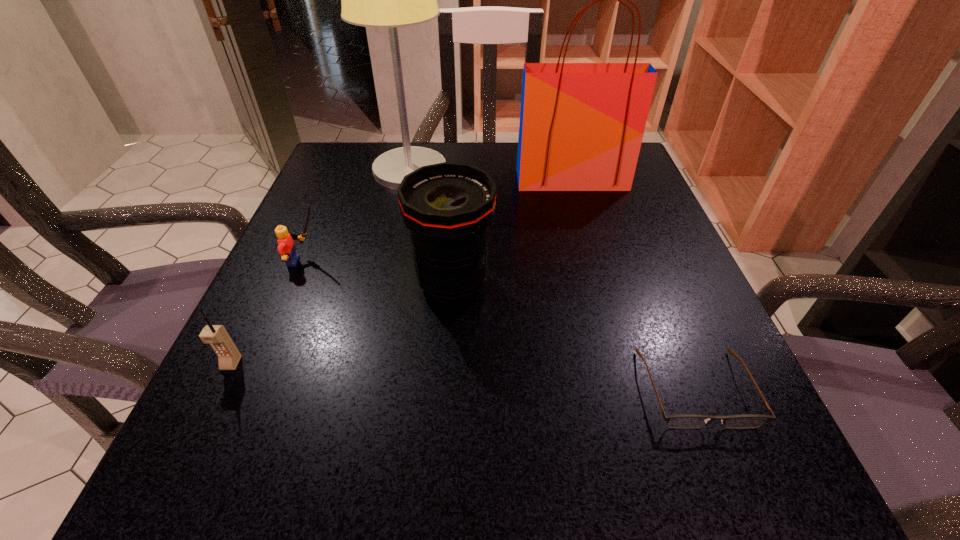
Find the location of a particular element. This screenshot has height=540, width=960. the tallest object is located at coordinates (389, 0).

Locate an element on the screen. the second tallest object is located at coordinates (581, 127).

At what (x,y) coordinates should I click in order to perform the action: click on the third tallest object. Please return your answer as a coordinate pair (x, y). This screenshot has height=540, width=960. Looking at the image, I should click on (447, 207).

The width and height of the screenshot is (960, 540). I want to click on the leftmost object, so click(x=229, y=356).

Locate an element on the screen. This screenshot has height=540, width=960. Lego is located at coordinates [x=286, y=247].

Locate an element on the screen. the shortest object is located at coordinates [x=685, y=421].

Identify the location of vacant space positioned on the right of the table lamp. This screenshot has width=960, height=540. (474, 170).

Locate an element on the screen. The height and width of the screenshot is (540, 960). vacant area situated 0.400m on the handle side of the shopping bag is located at coordinates (615, 337).

I want to click on vacant region located 0.100m on the back of the telephoto lens, so click(x=457, y=224).

This screenshot has height=540, width=960. In order to click on vacant space located 0.060m on the front of the cellular telephone, where the keypad is located in this screenshot , I will do `click(209, 409)`.